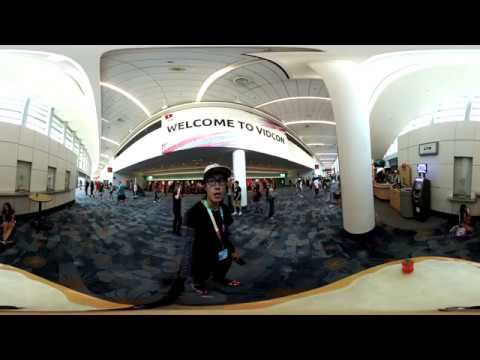
Locate an element on the screen. This screenshot has height=360, width=480. desk is located at coordinates (384, 192).